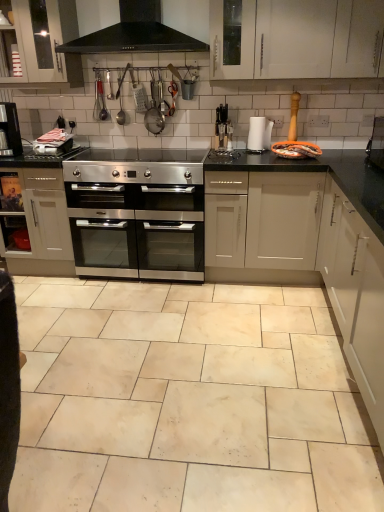
Question: From a real-world perspective, is white glossy cabinet at upper left, arranged as the 3th cabinetry when ordered from the bottom, physically above satin silver oven at center, the first cabinetry viewed from the left?

Choices:
 (A) no
 (B) yes

Answer: (B)

Question: Is white glossy cabinet at upper left, arranged as the 3th cabinetry when ordered from the bottom, behind satin silver oven at center, which is the 2th cabinetry in top-to-bottom order?

Choices:
 (A) no
 (B) yes

Answer: (A)

Question: Is white glossy cabinet at upper left, which ranks as the second cabinetry in right-to-left order, at the left side of satin silver oven at center, which is counted as the 3th cabinetry, starting from the right?

Choices:
 (A) no
 (B) yes

Answer: (A)

Question: Does white glossy cabinet at upper left, arranged as the 3th cabinetry when ordered from the bottom, come in front of satin silver oven at center, which is the 2th cabinetry in top-to-bottom order?

Choices:
 (A) yes
 (B) no

Answer: (A)

Question: Is satin silver oven at center, which is counted as the 3th cabinetry, starting from the right, at the back of white glossy cabinet at upper left, which ranks as the second cabinetry in right-to-left order?

Choices:
 (A) yes
 (B) no

Answer: (B)

Question: Visually, is black granite countertop at center positioned to the left or to the right of black matte exhaust hood at upper center?

Choices:
 (A) right
 (B) left

Answer: (A)

Question: From the image's perspective, is black granite countertop at center positioned above or below black matte exhaust hood at upper center?

Choices:
 (A) above
 (B) below

Answer: (B)

Question: Considering the positions of point (223, 159) and point (147, 23), is point (223, 159) closer or farther from the camera than point (147, 23)?

Choices:
 (A) farther
 (B) closer

Answer: (A)

Question: Do you think black granite countertop at center is within black matte exhaust hood at upper center, or outside of it?

Choices:
 (A) outside
 (B) inside

Answer: (A)

Question: Is black plastic coffee machine at center, the 2th appliance when ordered from right to left, in front of or behind satin silver oven at center, the first cabinetry viewed from the left, in the image?

Choices:
 (A) front
 (B) behind

Answer: (B)

Question: In terms of size, does black plastic coffee machine at center, which is the 1th appliance from left to right, appear bigger or smaller than satin silver oven at center, which is the 2th cabinetry in top-to-bottom order?

Choices:
 (A) small
 (B) big

Answer: (A)

Question: From the image's perspective, is black plastic coffee machine at center, the 2th appliance when ordered from right to left, above or below satin silver oven at center, the first cabinetry viewed from the left?

Choices:
 (A) above
 (B) below

Answer: (A)

Question: Looking at their shapes, would you say black plastic coffee machine at center, which is the 1th appliance from left to right, is wider or thinner than satin silver oven at center, marked as the 2th cabinetry in a bottom-to-top arrangement?

Choices:
 (A) thin
 (B) wide

Answer: (A)

Question: From a real-world perspective, is white paper towel at center, the 2th appliance positioned from the left, positioned above or below white matte cabinet at right, positioned as the 1th cabinetry in right-to-left order?

Choices:
 (A) below
 (B) above

Answer: (B)

Question: Is white paper towel at center, positioned as the first appliance in right-to-left order, inside the boundaries of white matte cabinet at right, which ranks as the 1th cabinetry in bottom-to-top order, or outside?

Choices:
 (A) outside
 (B) inside

Answer: (A)